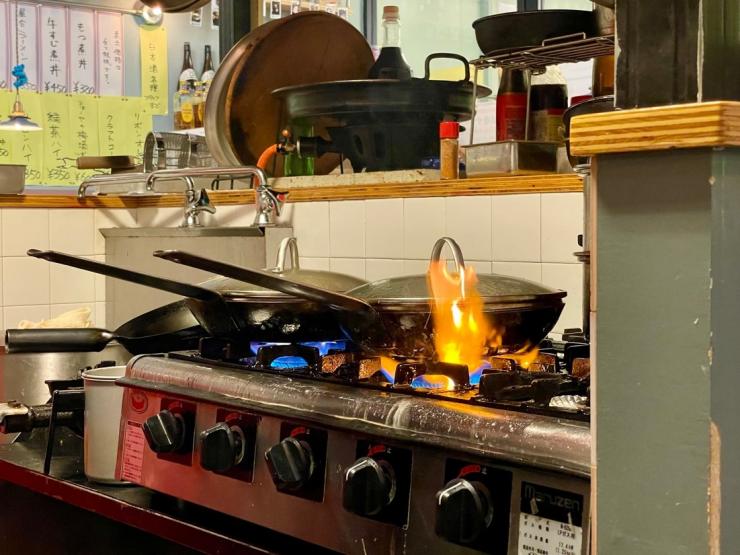
The width and height of the screenshot is (740, 555). Find the location of `faucet`. faucet is located at coordinates (249, 215), (189, 213).